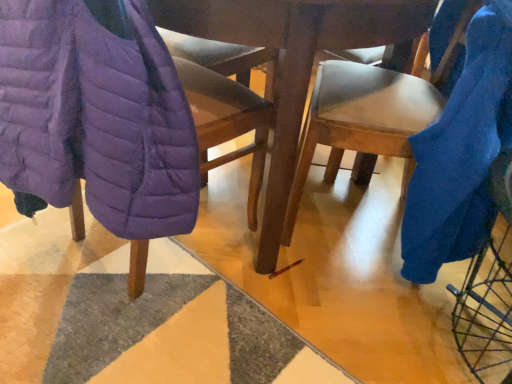
The width and height of the screenshot is (512, 384). Identify the location of free space on the front side of purple quilted jacket at left, the 1th chair positioned from the left. (118, 332).